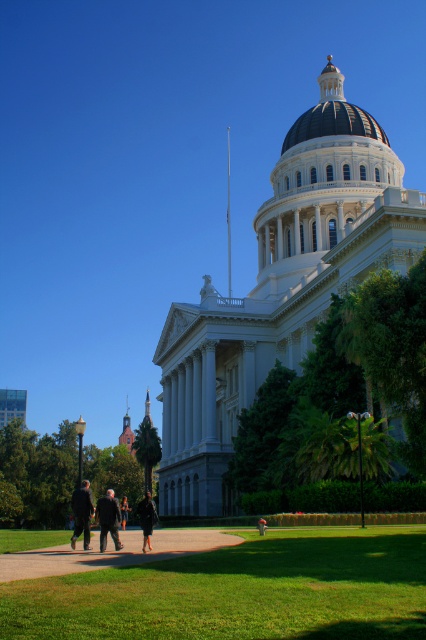
Question: Which of the following is the closest to the observer?

Choices:
 (A) (121, 524)
 (B) (393, 529)
 (C) (114, 522)
 (D) (152, 522)

Answer: (D)

Question: Where is grassy sidewalk at lower center located in relation to blue glossy dome at upper center in the image?

Choices:
 (A) below
 (B) above

Answer: (A)

Question: Estimate the real-world distances between objects in this image. Which object is closer to the dark brown leather coat at center?

Choices:
 (A) green grass at lower center
 (B) grassy sidewalk at lower center

Answer: (B)

Question: Does grassy sidewalk at lower center have a lesser width compared to dark brown leather coat at center?

Choices:
 (A) yes
 (B) no

Answer: (B)

Question: Can you confirm if green grass at lower center is bigger than dark gray suit at lower left?

Choices:
 (A) no
 (B) yes

Answer: (A)

Question: Among these points, which one is farthest from the camera?

Choices:
 (A) (123, 509)
 (B) (77, 570)

Answer: (A)